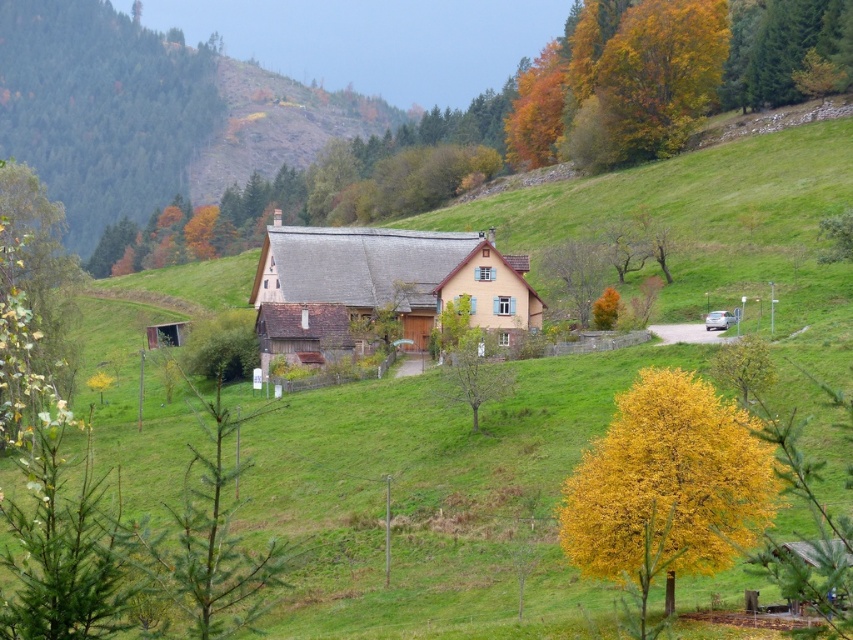
Question: Is the position of yellow leafy tree at lower right more distant than that of bare branches at center?

Choices:
 (A) yes
 (B) no

Answer: (B)

Question: Considering the real-world distances, which object is closest to the green matte tree at lower left?

Choices:
 (A) bare branches at center
 (B) green forested mountain at upper left

Answer: (A)

Question: Can you confirm if yellow leafy tree at lower right is positioned to the left of bare branches at center?

Choices:
 (A) yes
 (B) no

Answer: (B)

Question: Which is nearer to the yellow leafy tree at right?

Choices:
 (A) green needle-like at lower left
 (B) yellow leafy tree at lower right
 (C) green forested mountain at upper left
 (D) golden yellow leaves at upper right

Answer: (B)

Question: Can you confirm if golden yellow leaves at upper right is positioned above bare branches at center?

Choices:
 (A) no
 (B) yes

Answer: (B)

Question: Which point is closer to the camera taking this photo?

Choices:
 (A) (65, 408)
 (B) (474, 333)

Answer: (A)